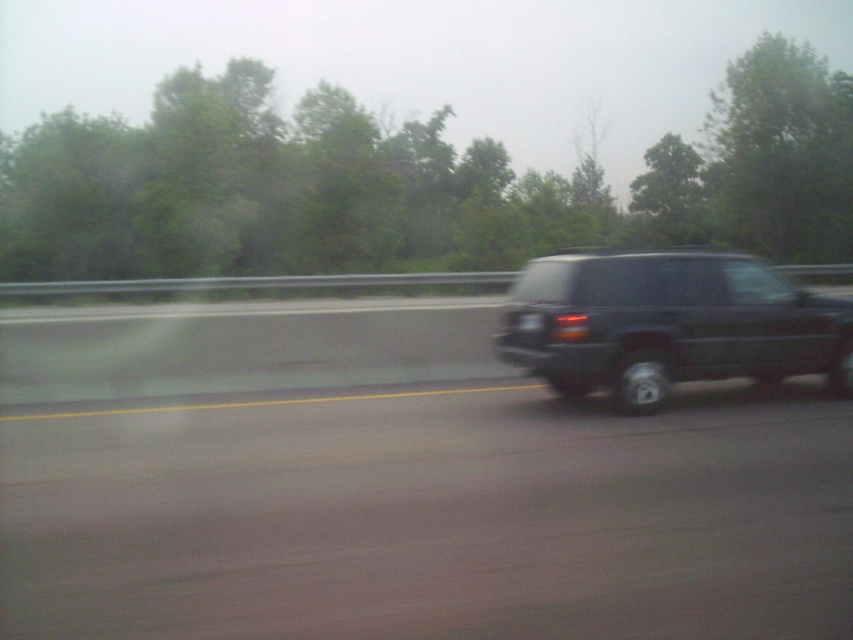
You are a passenger in a car and looking out the window. You see a green leafy tree at upper center and a black matte suv at right. Which object appears larger in the scene?

The green leafy tree at upper center appears larger than the black matte suv at right.

You are a photographer trying to capture a photo of the green leafy tree at upper center from your current position inside the vehicle. Given that the camera has a maximum focus range of 80 feet, will you be able to capture a clear image of the tree?

The green leafy tree at upper center and camera are 84.39 feet apart, which exceeds the camera maximum focus range of 80 feet. Therefore, you won not be able to capture a clear image of the tree.

You are a passenger in a car and notice the black matte suv at right through the window. Based on its position in the image, can you estimate whether it is closer to the front or the back of your vehicle?

The black matte suv at right is located at point (668, 324), which places it closer to the back of your vehicle compared to the front.